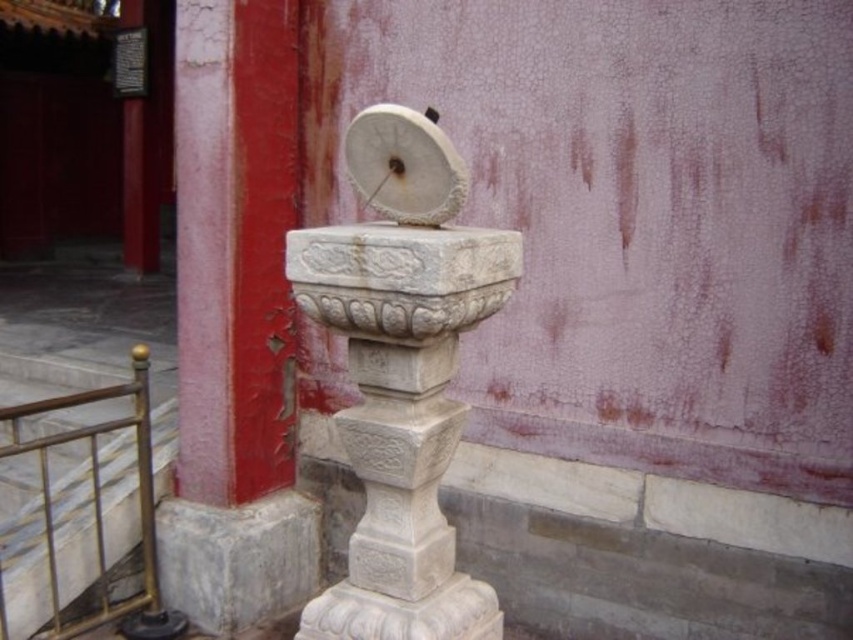
You are standing in front of a traditional Chinese building with red and pink walls. You see a white stone sundial at center and a brushed metal railing at lower left. Which object is positioned higher from the ground?

The white stone sundial at center is located above the brushed metal railing at lower left, so it is positioned higher from the ground.

You are a visitor standing at the entrance of the garden and see the white stone sundial at center and the brushed metal railing at lower left. Which object is closer to you?

The white stone sundial at center is closer to you because it is in front of the brushed metal railing at lower left.